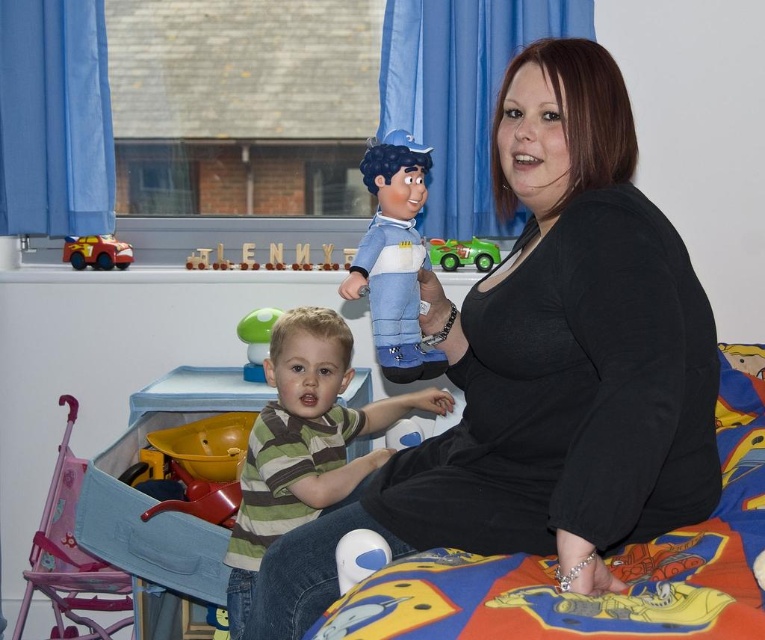
You are a toy organizer trying to decide whether to place the black matte shirt at center and the green matte car at center on the same shelf. The shelf can only hold items where the larger item is no more than twice the size of the smaller one. Can both items be placed together on the shelf?

The black matte shirt at center is bigger than the green matte car at center. Since the larger item must be no more than twice the size of the smaller one, we need to know the exact size difference. However, the description only states that the shirt is bigger, not the exact ratio. Therefore, it is uncertain if they can be placed together without additional information.

What object is located at the coordinates point (394, 257)?

The point (394, 257) corresponds to the matte blue plush at center.

You are helping a child organize their toys. The child has a matte blue plush at center and a green rubber toy at center. Which toy should you choose if you need to place a larger toy into the bigger storage bin?

The matte blue plush at center is larger than the green rubber toy at center, so you should choose the matte blue plush at center for the bigger storage bin.